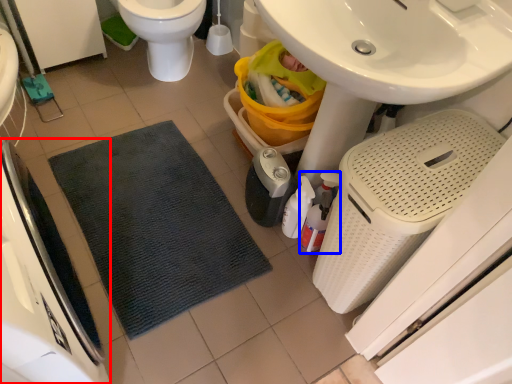
Question: Which point is further to the camera, appliance (highlighted by a red box) or cleaning product (highlighted by a blue box)?

Choices:
 (A) appliance
 (B) cleaning product

Answer: (B)